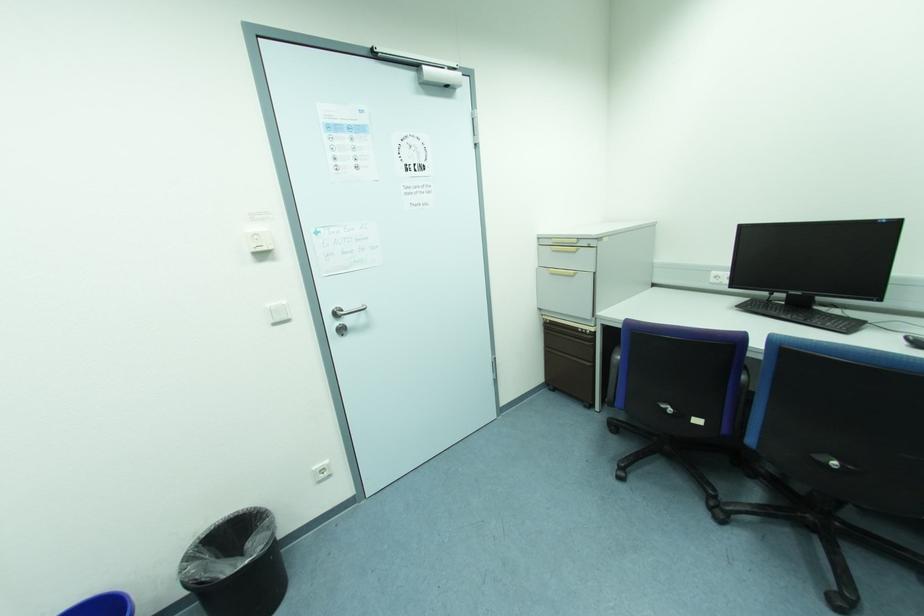
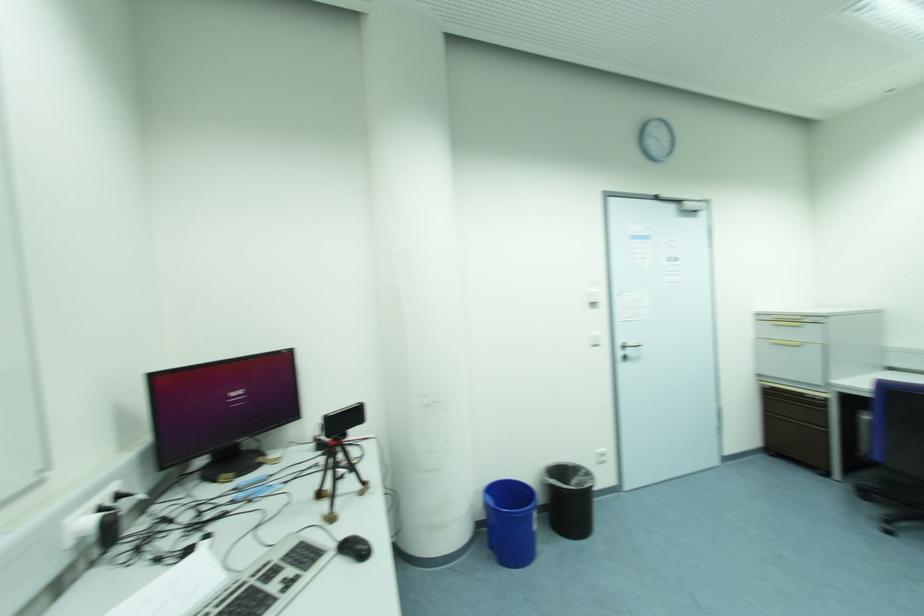
Consider the image. The images are taken continuously from a first-person perspective. In which direction are you moving?

The cameraman moved toward left, backward.